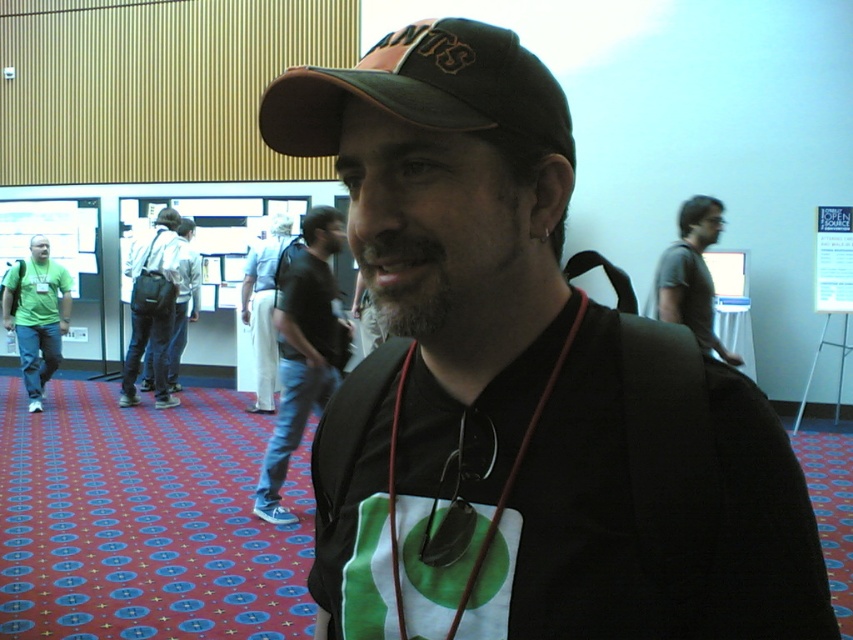
You are standing in the conference hall and see two points marked in the image. Which point, point (465, 269) or point (171, 362), is closer to you?

Point (465, 269) is closer to the camera than point (171, 362), so it is closer to you.

You are a fashion designer observing the man in the scene. You need to determine which item of clothing is narrower between the black fabric shirt at center and the white cotton pants at center. Which one is it?

The black fabric shirt at center is thinner than the white cotton pants at center, so the black fabric shirt at center is narrower.